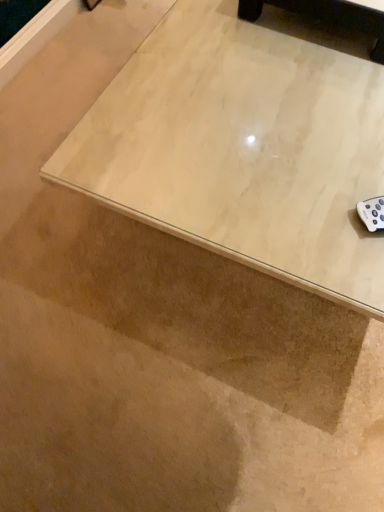
Question: Is light wood table at upper right surrounded by light wood coffee table at upper center?

Choices:
 (A) no
 (B) yes

Answer: (A)

Question: Is light wood coffee table at upper center at the left side of light wood table at upper right?

Choices:
 (A) yes
 (B) no

Answer: (A)

Question: Can you confirm if light wood coffee table at upper center is shorter than light wood table at upper right?

Choices:
 (A) yes
 (B) no

Answer: (A)

Question: From a real-world perspective, is light wood coffee table at upper center on top of light wood table at upper right?

Choices:
 (A) no
 (B) yes

Answer: (B)

Question: Is light wood coffee table at upper center further to camera compared to light wood table at upper right?

Choices:
 (A) yes
 (B) no

Answer: (A)

Question: Can you confirm if light wood coffee table at upper center is taller than light wood table at upper right?

Choices:
 (A) yes
 (B) no

Answer: (B)

Question: Is light wood table at upper right bigger than light wood coffee table at upper center?

Choices:
 (A) no
 (B) yes

Answer: (B)

Question: Considering the relative positions of light wood table at upper right and light wood coffee table at upper center in the image provided, is light wood table at upper right in front of light wood coffee table at upper center?

Choices:
 (A) no
 (B) yes

Answer: (B)

Question: Is light wood table at upper right wider than light wood coffee table at upper center?

Choices:
 (A) yes
 (B) no

Answer: (A)

Question: From the image's perspective, would you say light wood table at upper right is shown under light wood coffee table at upper center?

Choices:
 (A) yes
 (B) no

Answer: (A)

Question: Is light wood table at upper right smaller than light wood coffee table at upper center?

Choices:
 (A) yes
 (B) no

Answer: (B)

Question: From a real-world perspective, is light wood table at upper right beneath light wood coffee table at upper center?

Choices:
 (A) no
 (B) yes

Answer: (B)

Question: Is light wood table at upper right inside the boundaries of light wood coffee table at upper center, or outside?

Choices:
 (A) inside
 (B) outside

Answer: (B)